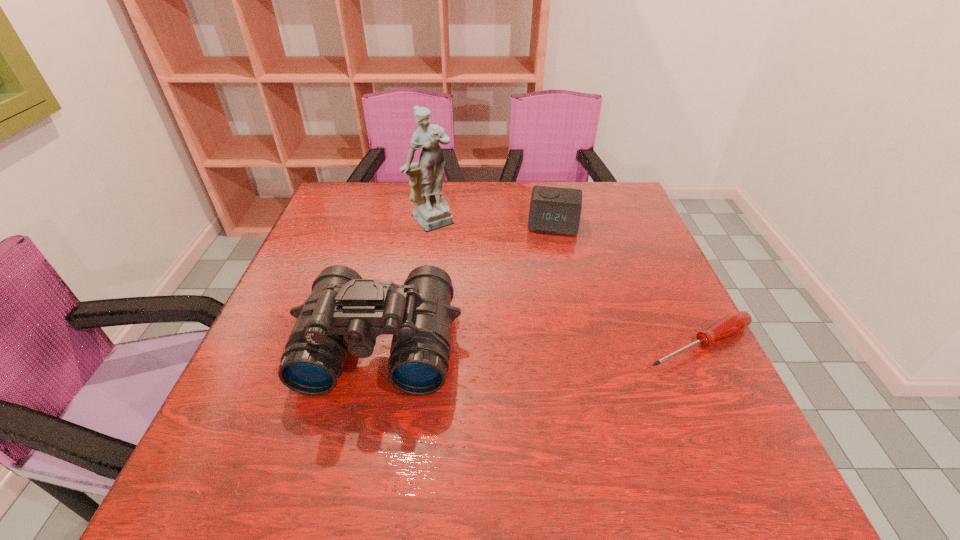
Find the location of a particular element. free point between the rightmost object and the figurine is located at coordinates (566, 282).

The height and width of the screenshot is (540, 960). I want to click on free space between the second shortest object and the second tallest object, so click(467, 284).

Image resolution: width=960 pixels, height=540 pixels. I want to click on vacant area between the third shortest object and the shortest object, so click(x=540, y=344).

Where is `object that is the closest to the binoculars`? This screenshot has height=540, width=960. object that is the closest to the binoculars is located at coordinates (431, 210).

Identify the location of object that is the second nearest to the binoculars. point(554,210).

Find the location of a particular element. Image resolution: width=960 pixels, height=540 pixels. vacant space that satisfies the following two spatial constraints: 1. through the lenses of the shortest object; 2. on the right side of the binoculars is located at coordinates (379, 345).

Find the location of a particular element. The height and width of the screenshot is (540, 960). vacant position in the image that satisfies the following two spatial constraints: 1. through the lenses of the binoculars; 2. on the right side of the rightmost object is located at coordinates (379, 345).

Find the location of a particular element. free spot that satisfies the following two spatial constraints: 1. through the lenses of the shortest object; 2. on the left side of the third shortest object is located at coordinates (379, 345).